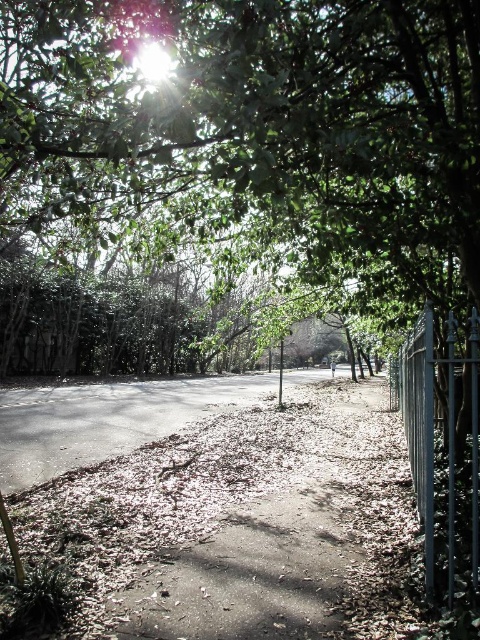
Question: Among these points, which one is farthest from the camera?

Choices:
 (A) (468, 512)
 (B) (403, 246)

Answer: (B)

Question: Where is green leafy tree at center located in relation to metallic silver fence at right in the image?

Choices:
 (A) above
 (B) below

Answer: (A)

Question: Which point is farther from the camera taking this photo?

Choices:
 (A) (444, 388)
 (B) (48, 72)

Answer: (A)

Question: Does green leafy tree at center have a greater width compared to metallic silver fence at right?

Choices:
 (A) no
 (B) yes

Answer: (B)

Question: Does green leafy tree at center have a smaller size compared to metallic silver fence at right?

Choices:
 (A) yes
 (B) no

Answer: (A)